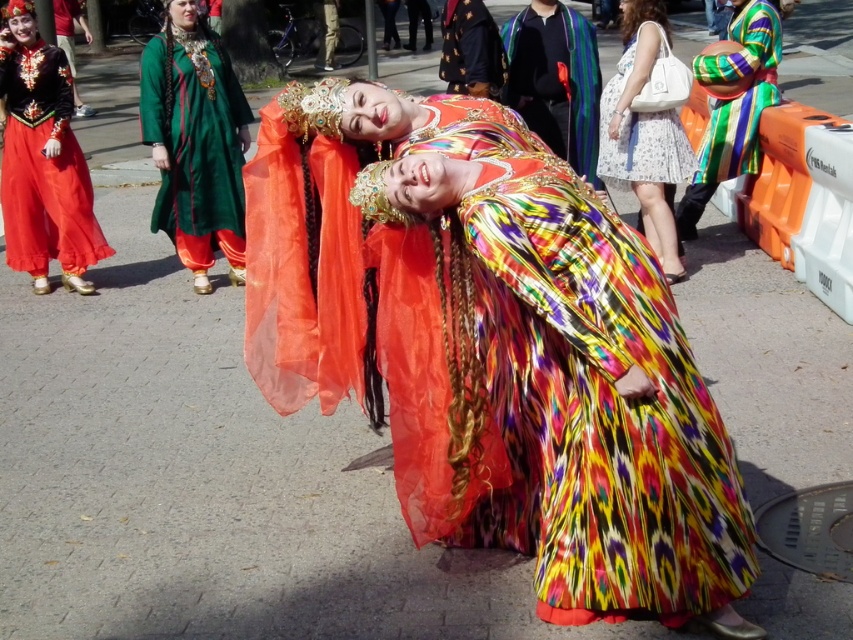
Who is shorter, green silk dress at upper left or silky multicolored fabric at center?

With less height is silky multicolored fabric at center.

Is green silk dress at upper left below silky multicolored fabric at center?

Yes.

Is point (229, 156) positioned before point (535, 6)?

No.

Where is `green silk dress at upper left`? The height and width of the screenshot is (640, 853). green silk dress at upper left is located at coordinates (195, 141).

Is multicolored silk dress at center thinner than silky multicolored fabric at center?

No, multicolored silk dress at center is not thinner than silky multicolored fabric at center.

Is point (447, 108) positioned after point (535, 93)?

No.

Between point (405, 224) and point (515, 86), which one is positioned in front?

Point (405, 224)

At what (x,y) coordinates should I click in order to perform the action: click on multicolored silk dress at center. Please return your answer as a coordinate pair (x, y). Image resolution: width=853 pixels, height=640 pixels. Looking at the image, I should click on (534, 364).

Does green silk dress at upper left have a smaller size compared to multicolored striped dress at right?

Yes.

The image size is (853, 640). I want to click on green silk dress at upper left, so click(195, 141).